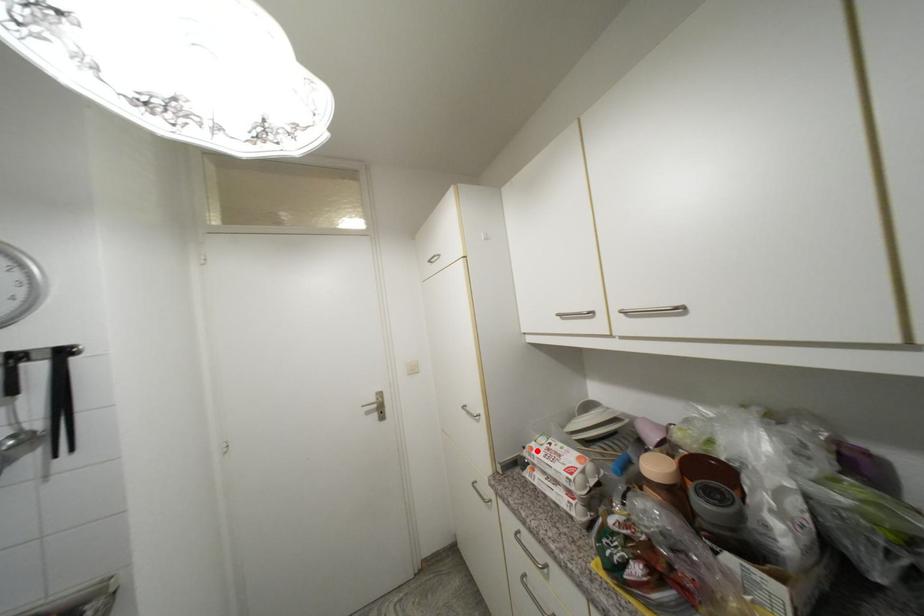
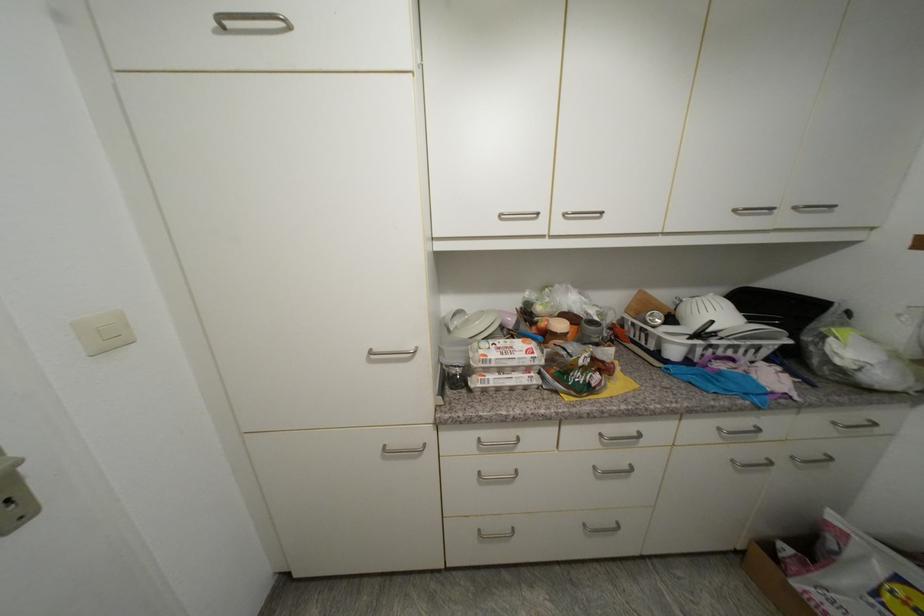
In the second image, find the point that corresponds to the highlighted location in the first image.

(492, 357)